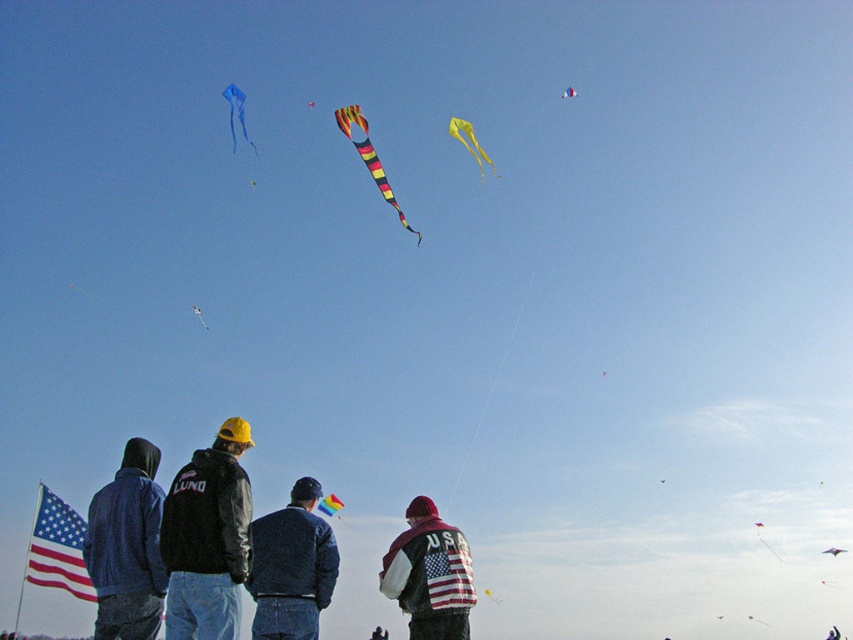
You are a photographer trying to capture a photo of the rainbow fabric kite at upper center without the american flag patterned jacket at center blocking it. Is the jacket currently in front of the kite?

The american flag patterned jacket at center is above the rainbow fabric kite at upper center, so the jacket is not blocking the kite and you can take the photo without obstruction.

You are standing at the center of the field and see two points in the scene. The first point is labeled as point (x=229, y=90) and the second is point (x=328, y=497). Which point is closer to you?

Point (x=229, y=90) is in front of point (x=328, y=497), so it is closer to you.

You are a kite enthusiast observing the scene. You notice the blue fabric kite at upper left and the rainbow fabric kite at upper center. Which kite is positioned closer to you?

The blue fabric kite at upper left is closer to the viewer than the rainbow fabric kite at upper center.